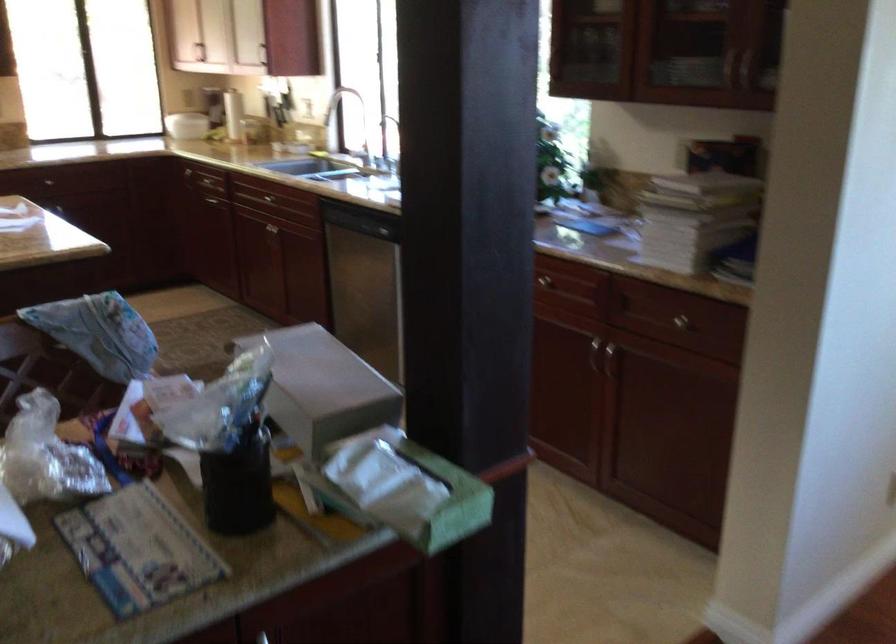
This screenshot has width=896, height=644. What do you see at coordinates (354, 149) in the screenshot?
I see `the faucet handle` at bounding box center [354, 149].